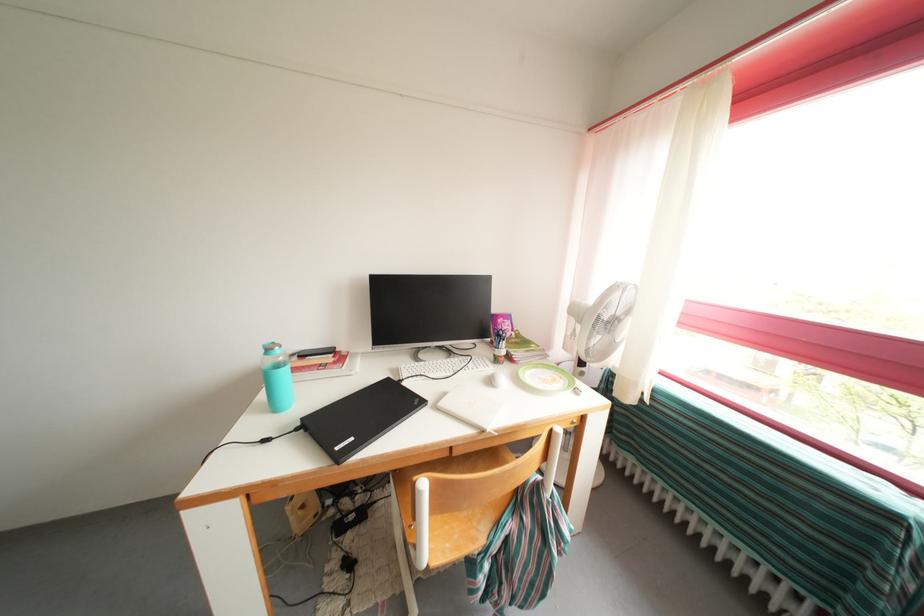
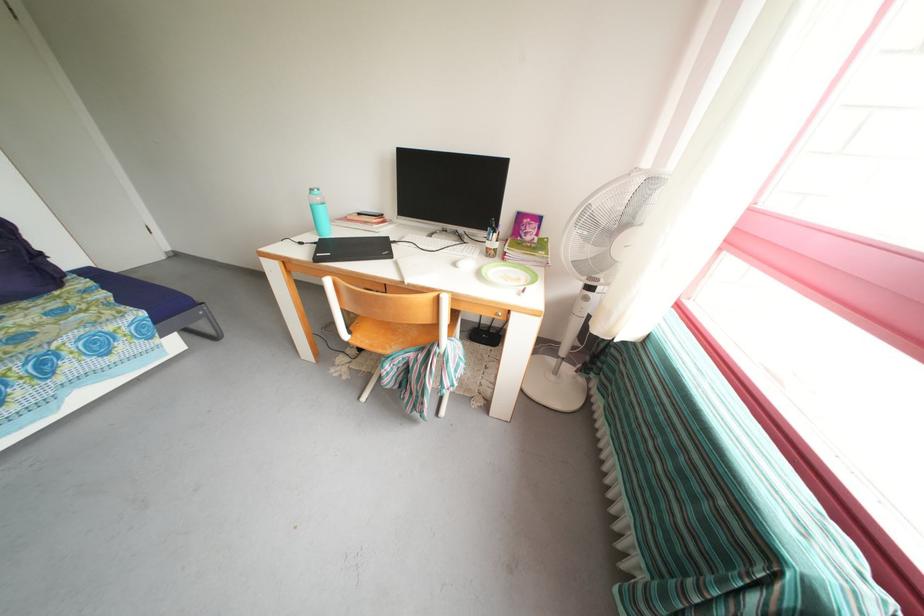
The point at [423,363] is marked in the first image. Where is the corresponding point in the second image?

(436, 241)